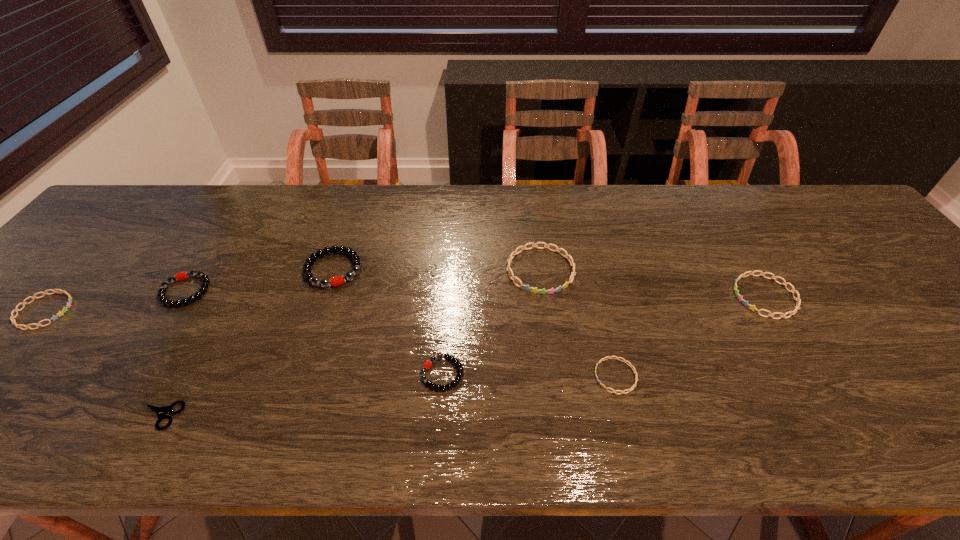
The image size is (960, 540). What are the coordinates of `vacant area at the near edge` in the screenshot? It's located at (926, 416).

This screenshot has height=540, width=960. I want to click on vacant position at the left edge of the desktop, so click(59, 285).

This screenshot has width=960, height=540. In order to click on free space at the right edge of the desktop in this screenshot , I will do `click(918, 286)`.

In the image, there is a desktop. Identify the location of free space at the far right corner. (832, 207).

In order to click on free space between the leftmost bracelet and the shortest object in this screenshot , I will do `click(102, 363)`.

Where is `unoccupied area between the rightmost blue bracelet and the shortest object`? This screenshot has height=540, width=960. unoccupied area between the rightmost blue bracelet and the shortest object is located at coordinates (462, 356).

You are a GUI agent. You are given a task and a screenshot of the screen. Output one action in this format:
    pyautogui.click(x=<x>, y=<y>)
    Task: Click on the free space between the rightmost bracelet and the biggest blue bracelet
    Image resolution: width=960 pixels, height=540 pixels.
    Given the screenshot: What is the action you would take?
    coord(653,284)

Identify the location of vacant area that lies between the smallest black bracelet and the rightmost bracelet. (604, 335).

The width and height of the screenshot is (960, 540). I want to click on vacant point located between the nearest blue bracelet and the second biggest black bracelet, so click(x=400, y=334).

The height and width of the screenshot is (540, 960). Identify the location of free area in between the biggest blue bracelet and the fourth bracelet from right to left. (492, 322).